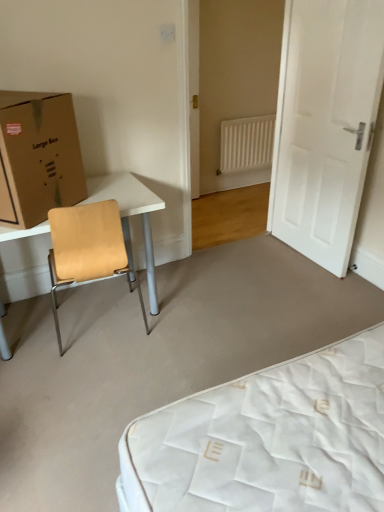
Question: Is white plastic radiator at center aimed at white matte door at right?

Choices:
 (A) no
 (B) yes

Answer: (B)

Question: Considering the relative positions of white plastic radiator at center and white matte door at right in the image provided, is white plastic radiator at center in front of white matte door at right?

Choices:
 (A) yes
 (B) no

Answer: (B)

Question: Considering the relative sizes of white plastic radiator at center and white matte door at right in the image provided, is white plastic radiator at center taller than white matte door at right?

Choices:
 (A) no
 (B) yes

Answer: (A)

Question: Is white plastic radiator at center not close to white matte door at right?

Choices:
 (A) yes
 (B) no

Answer: (A)

Question: Would you say white plastic radiator at center contains white matte door at right?

Choices:
 (A) no
 (B) yes

Answer: (A)

Question: Is white plastic radiator at center completely or partially outside of white matte door at right?

Choices:
 (A) yes
 (B) no

Answer: (A)

Question: From the image's perspective, is light brown wood table at left beneath white plastic radiator at center?

Choices:
 (A) no
 (B) yes

Answer: (B)

Question: Can you confirm if light brown wood table at left is taller than white plastic radiator at center?

Choices:
 (A) yes
 (B) no

Answer: (A)

Question: Considering the relative sizes of light brown wood table at left and white plastic radiator at center in the image provided, is light brown wood table at left bigger than white plastic radiator at center?

Choices:
 (A) yes
 (B) no

Answer: (A)

Question: Can you confirm if light brown wood table at left is shorter than white plastic radiator at center?

Choices:
 (A) yes
 (B) no

Answer: (B)

Question: Could white plastic radiator at center be considered to be inside light brown wood table at left?

Choices:
 (A) no
 (B) yes

Answer: (A)

Question: From the image's perspective, would you say light brown wood table at left is positioned over white plastic radiator at center?

Choices:
 (A) yes
 (B) no

Answer: (B)

Question: Can you see white plastic radiator at center touching brown cardboard box at left?

Choices:
 (A) yes
 (B) no

Answer: (B)